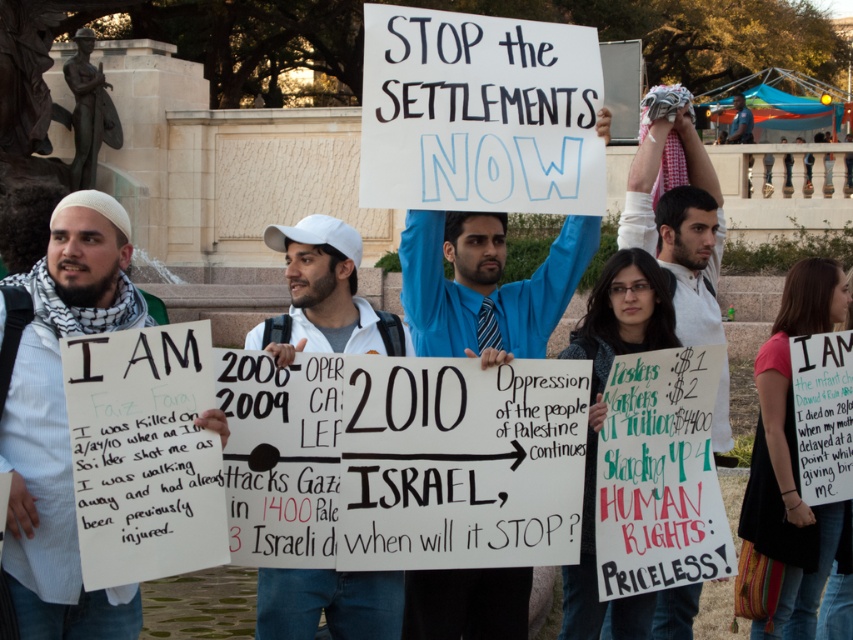
Question: Among these objects, which one is nearest to the camera?

Choices:
 (A) white cotton shirt at upper right
 (B) white cotton cap at center

Answer: (B)

Question: Is blue shirt at center below white cotton cap at center?

Choices:
 (A) no
 (B) yes

Answer: (A)

Question: Does blue shirt at center lie behind white cotton cap at center?

Choices:
 (A) yes
 (B) no

Answer: (A)

Question: Which object is the closest to the white cotton shirt at upper right?

Choices:
 (A) white striped scarf at left
 (B) blue shirt at center

Answer: (B)

Question: Observing the image, what is the correct spatial positioning of white cotton cap at center in reference to white cotton shirt at upper right?

Choices:
 (A) above
 (B) below

Answer: (B)

Question: Which point is farther to the camera?

Choices:
 (A) [572, 252]
 (B) [367, 595]
 (C) [39, 616]

Answer: (A)